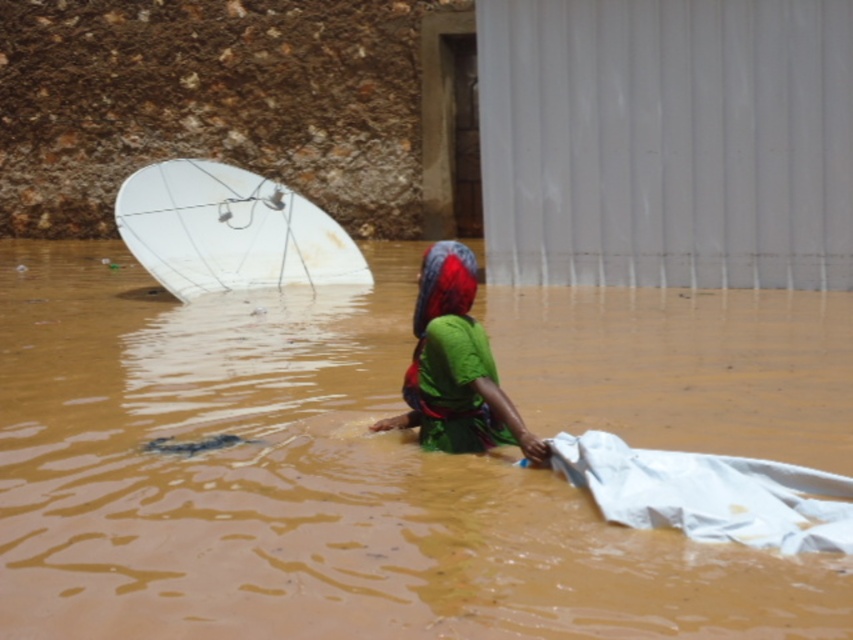
You are a rescue drone operator trying to locate a satellite dish in the flooded area. According to the image, where is the white glossy satellite dish at upper left positioned relative to the woman?

The white glossy satellite dish at upper left is located at point (229, 230), which places it to the upper left of the woman in the image.

You are a drone operator trying to capture a clear image of the white glossy satellite dish at upper left. The drone has a camera with a 50mm focal length lens. Given the satellite dish is located at coordinates point 0.362, 0.270 in the image, what is the exact position of the white glossy satellite dish in the image?

The white glossy satellite dish at upper left is located at point (229, 230) in the image.

You are a photographer trying to capture the scene of the flooded area. You notice the white glossy satellite dish at upper left and the green fabric at center. Which object should you focus on first if you want to take a photo that includes both in the same frame without moving the camera?

You should focus on the white glossy satellite dish at upper left first because it is closer to you than the green fabric at center. By focusing on the closer object, the background object will also be in focus due to depth of field.